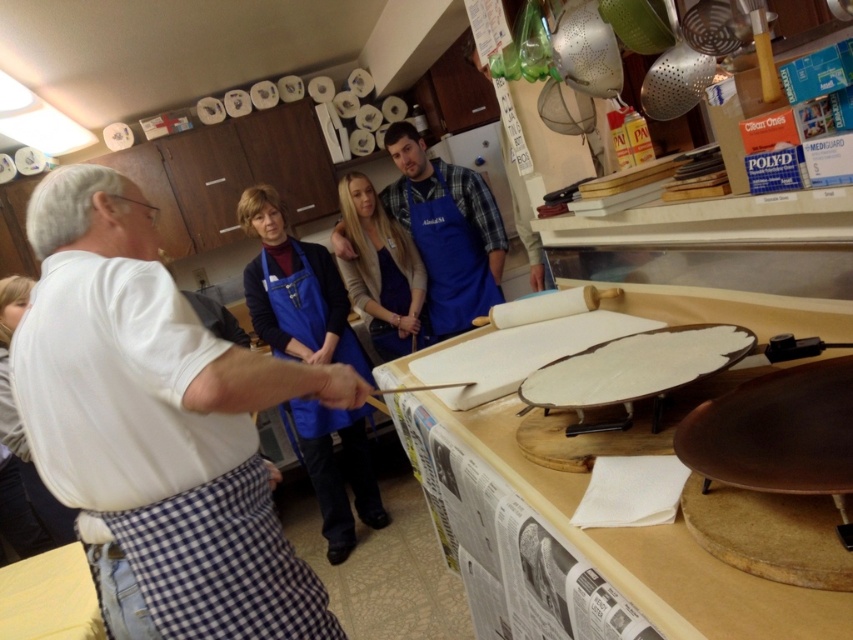
In the scene shown: You are standing in the workshop and want to reach a specific point in the room. The point is located at coordinates point (450, 184). If you need to move towards this point, how far will you have to walk?

The distance of point (450, 184) from camera is 3.14 meters, so you will have to walk 3.14 meters to reach the point.

You are standing at the point with coordinates point [631,349]. You want to move to the point with coordinates point [465,316]. Is there a clear path between these two points without any obstacles?

Point [465,316] is behind point [631,349], so there might be an obstacle blocking the path between them.

You are a participant in the cooking class and want to place a white matte plate at center on the table. The blue apron at center is in your way. Can you move the plate to the right to avoid the apron?

The blue apron at center is to the left of the white matte plate at center, so moving the plate to the right would not interfere with the apron. Yes, you can move the plate to the right to avoid the apron.